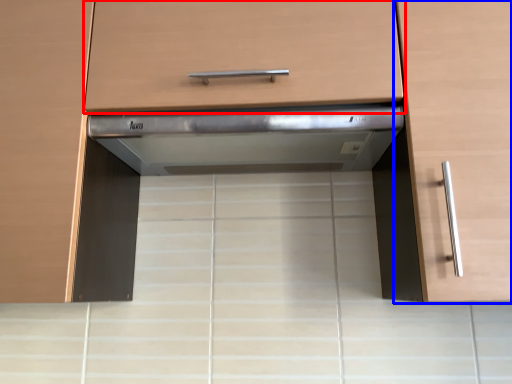
Question: Which point is closer to the camera, drawer (highlighted by a red box) or cabinetry (highlighted by a blue box)?

Choices:
 (A) drawer
 (B) cabinetry

Answer: (B)